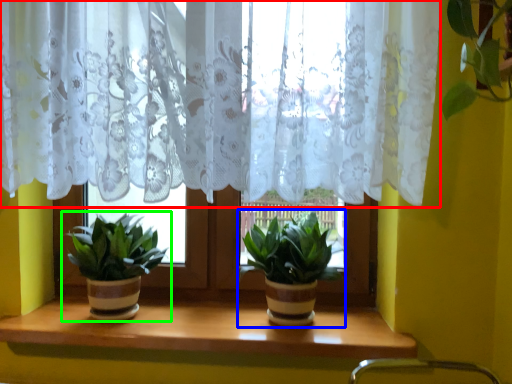
Question: Which object is positioned farthest from curtain (highlighted by a red box)? Select from houseplant (highlighted by a blue box) and houseplant (highlighted by a green box).

Choices:
 (A) houseplant
 (B) houseplant

Answer: (B)